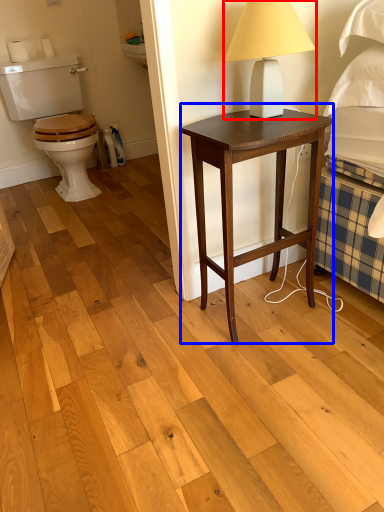
Question: Which point is further to the camera, table lamp (highlighted by a red box) or nightstand (highlighted by a blue box)?

Choices:
 (A) table lamp
 (B) nightstand

Answer: (B)